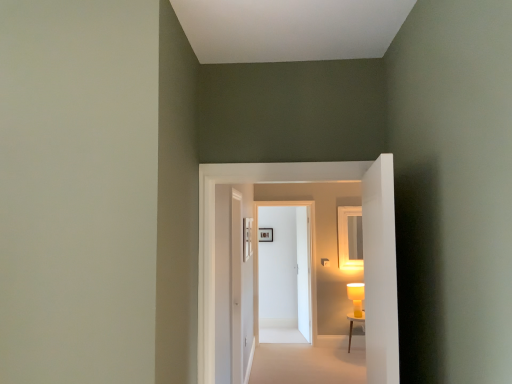
Question: Can you confirm if white glossy door at center, the third door when ordered from back to front, is shorter than matte yellow table lamp at right?

Choices:
 (A) yes
 (B) no

Answer: (B)

Question: Is white glossy door at center, the 1th door from the front, positioned far away from matte yellow table lamp at right?

Choices:
 (A) yes
 (B) no

Answer: (A)

Question: Is white glossy door at center, the third door when ordered from back to front, facing towards matte yellow table lamp at right?

Choices:
 (A) no
 (B) yes

Answer: (A)

Question: Is white glossy door at center, the third door when ordered from back to front, placed right next to matte yellow table lamp at right?

Choices:
 (A) yes
 (B) no

Answer: (B)

Question: Is white glossy door at center, the 1th door from the front, looking in the opposite direction of matte yellow table lamp at right?

Choices:
 (A) yes
 (B) no

Answer: (A)

Question: From their relative heights in the image, would you say white glossy door at center, the 1th door from the front, is taller or shorter than white wooden table at lower right?

Choices:
 (A) short
 (B) tall

Answer: (B)

Question: Would you say white glossy door at center, the third door when ordered from back to front, is to the left or to the right of white wooden table at lower right in the picture?

Choices:
 (A) right
 (B) left

Answer: (B)

Question: Is point (292, 168) closer or farther from the camera than point (364, 332)?

Choices:
 (A) closer
 (B) farther

Answer: (A)

Question: From a real-world perspective, is white glossy door at center, the 1th door from the front, physically located above or below white wooden table at lower right?

Choices:
 (A) below
 (B) above

Answer: (B)

Question: From a real-world perspective, is white glossy door at center, marked as the third door in a front-to-back arrangement, above or below matte black picture frame at center?

Choices:
 (A) below
 (B) above

Answer: (A)

Question: Is point (297, 286) closer or farther from the camera than point (259, 231)?

Choices:
 (A) closer
 (B) farther

Answer: (B)

Question: Is white glossy door at center, positioned as the first door in back-to-front order, inside the boundaries of matte black picture frame at center, or outside?

Choices:
 (A) inside
 (B) outside

Answer: (B)

Question: Based on their positions, is white glossy door at center, marked as the third door in a front-to-back arrangement, located to the left or right of matte black picture frame at center?

Choices:
 (A) left
 (B) right

Answer: (B)

Question: Is white glossy door at center, positioned as the first door in back-to-front order, to the left or to the right of white glossy door at center, the 1th door from the front, in the image?

Choices:
 (A) left
 (B) right

Answer: (B)

Question: Is white glossy door at center, marked as the third door in a front-to-back arrangement, in front of or behind white glossy door at center, the 1th door from the front, in the image?

Choices:
 (A) front
 (B) behind

Answer: (B)